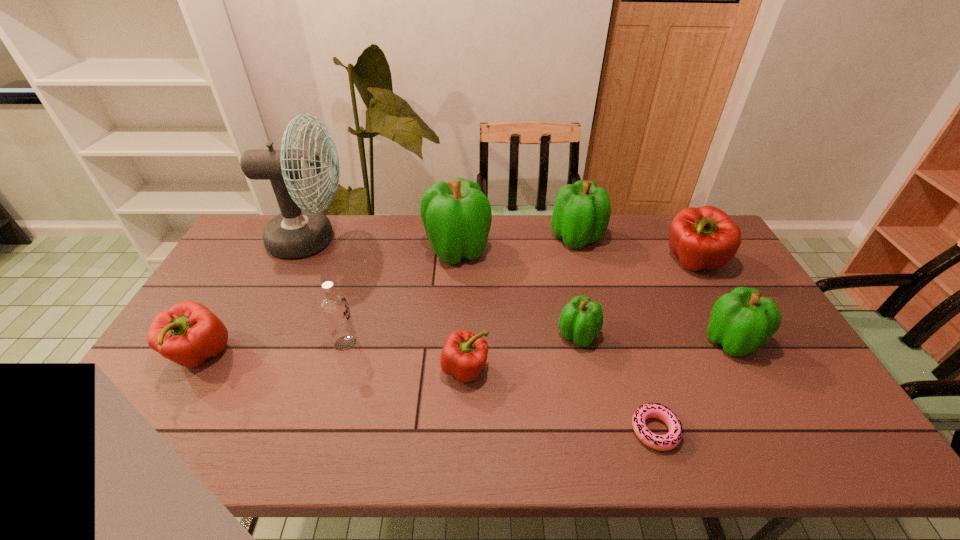
Locate an element on the screen. Image resolution: width=960 pixels, height=540 pixels. free space that satisfies the following two spatial constraints: 1. in front of the fan where the airflow is directed; 2. on the right side of the second pink bell pepper from right to left is located at coordinates (251, 369).

Locate an element on the screen. The image size is (960, 540). free space that satisfies the following two spatial constraints: 1. on the back side of the smallest green bell pepper; 2. on the left side of the second biggest green bell pepper is located at coordinates (557, 238).